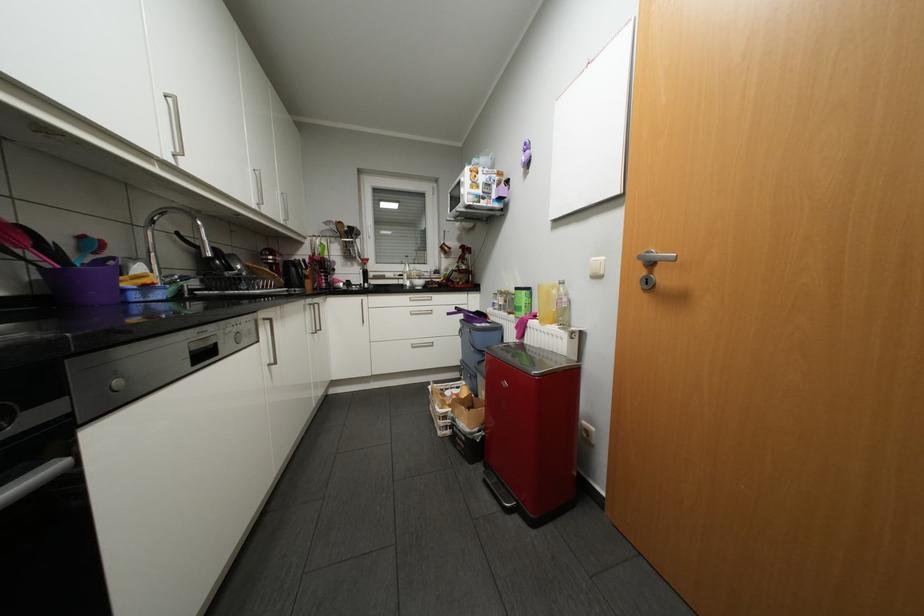
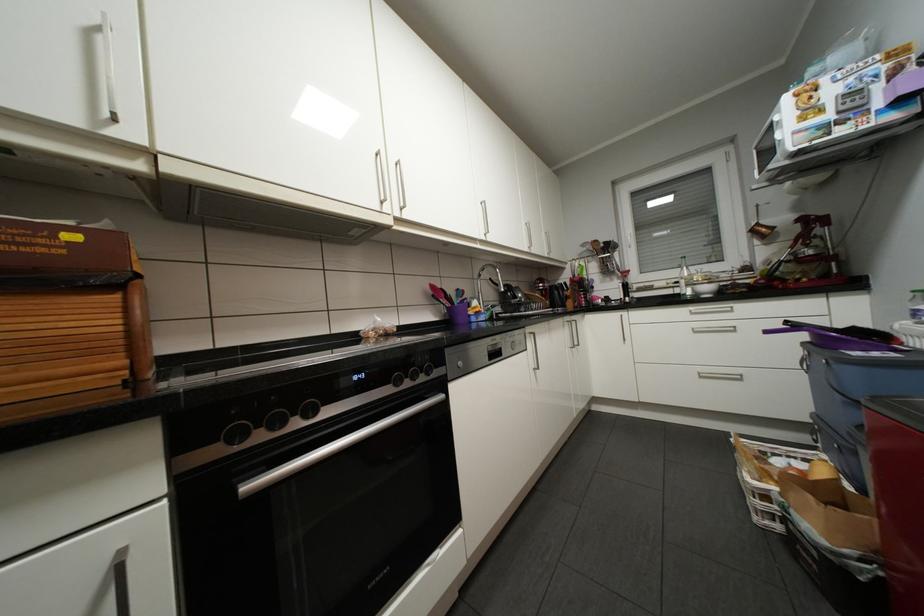
In the second image, find the point that corresponds to (x=409, y=284) in the first image.

(687, 294)